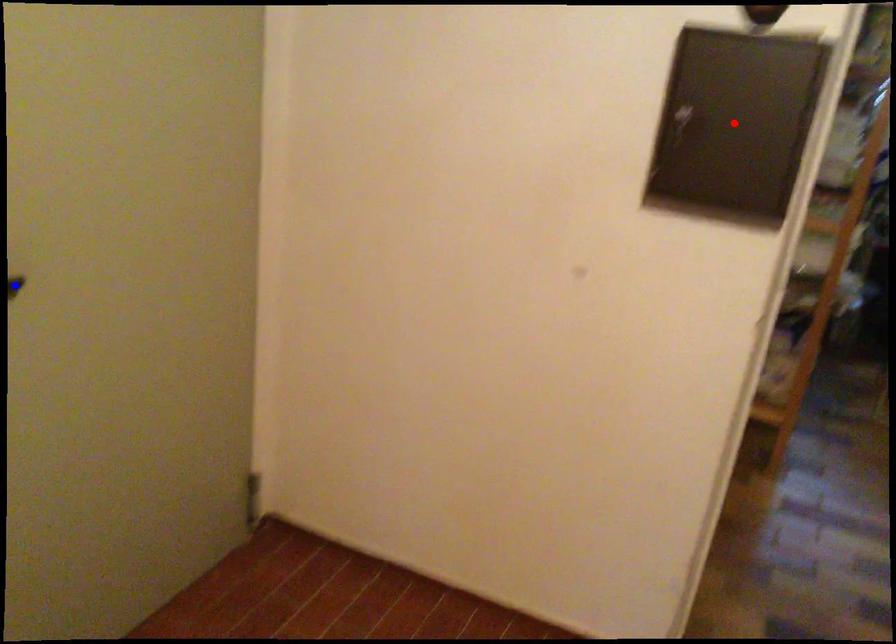
Question: Which of the two points in the image is closer to the camera?

Choices:
 (A) Blue point is closer.
 (B) Red point is closer.

Answer: (A)